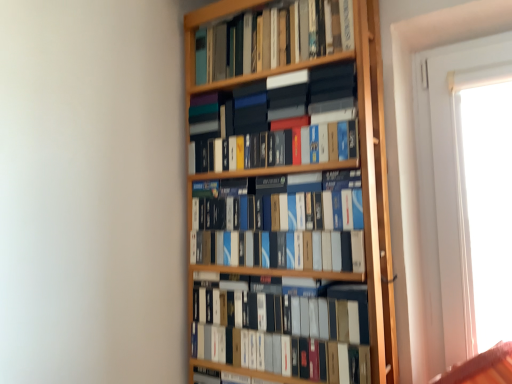
Image resolution: width=512 pixels, height=384 pixels. What are the coordinates of `blue matte book at center, which is the 3th book in top-to-bottom order` in the screenshot? It's located at 276,233.

Find the location of a particular element. Image resolution: width=512 pixels, height=384 pixels. blue matte book at center, the second book from the bottom is located at coordinates (276, 233).

Is hardcover books at upper center, which is the 1th book in top-to-bottom order, oriented towards blue matte book at center, the second book from the bottom?

No.

Which is closer, [289,46] or [279,209]?

The point [279,209] is closer.

Can you see hardcover books at upper center, marked as the 4th book in a bottom-to-top arrangement, touching blue matte book at center, the second book from the bottom?

No, hardcover books at upper center, marked as the 4th book in a bottom-to-top arrangement, is not touching blue matte book at center, the second book from the bottom.

From the image's perspective, which is above, matte black box at center, the 4th book positioned from the top, or hardcover books at upper center, marked as the 4th book in a bottom-to-top arrangement?

From the image's view, hardcover books at upper center, marked as the 4th book in a bottom-to-top arrangement, is above.

Is matte black box at center, positioned as the first book in bottom-to-top order, not within hardcover books at upper center, marked as the 4th book in a bottom-to-top arrangement?

Indeed, matte black box at center, positioned as the first book in bottom-to-top order, is completely outside hardcover books at upper center, marked as the 4th book in a bottom-to-top arrangement.

From a real-world perspective, who is located higher, matte black box at center, positioned as the first book in bottom-to-top order, or hardcover books at upper center, which is the 1th book in top-to-bottom order?

From a 3D spatial view, hardcover books at upper center, which is the 1th book in top-to-bottom order, is above.

From a real-world perspective, count 3rd books upward from the matte black box at center, positioned as the first book in bottom-to-top order, and point to it. Please provide its 2D coordinates.

[(272, 39)]

Is matte black box at center, the 4th book positioned from the top, closer to camera compared to blue matte book at center, the second book from the bottom?

Yes, matte black box at center, the 4th book positioned from the top, is closer to the camera.

Is point (259, 340) farther from camera compared to point (265, 257)?

No.

Consider the image. Is matte black box at center, positioned as the first book in bottom-to-top order, at the right side of blue matte book at center, which is the 3th book in top-to-bottom order?

Yes.

Looking at this image, from a real-world perspective, is matte black box at center, positioned as the first book in bottom-to-top order, on top of blue matte book at center, which is the 3th book in top-to-bottom order?

No, from a real-world perspective, matte black box at center, positioned as the first book in bottom-to-top order, is not above blue matte book at center, which is the 3th book in top-to-bottom order.

Considering the relative sizes of matte black box at center, positioned as the first book in bottom-to-top order, and matte black books at center, the 2th book when ordered from top to bottom, in the image provided, is matte black box at center, positioned as the first book in bottom-to-top order, shorter than matte black books at center, the 2th book when ordered from top to bottom,?

No.

Is the depth of matte black box at center, the 4th book positioned from the top, less than that of matte black books at center, the 2th book when ordered from top to bottom?

That is True.

From the image's perspective, which one is positioned lower, matte black box at center, positioned as the first book in bottom-to-top order, or matte black books at center, the third book positioned from the bottom?

From the image's view, matte black box at center, positioned as the first book in bottom-to-top order, is below.

From the picture: From a real-world perspective, is matte black box at center, the 4th book positioned from the top, positioned above or below matte black books at center, the third book positioned from the bottom?

matte black box at center, the 4th book positioned from the top, is situated lower than matte black books at center, the third book positioned from the bottom, in the real world.

Which is closer, (289, 202) or (308, 100)?

Point (289, 202).

Considering the relative sizes of blue matte book at center, which is the 3th book in top-to-bottom order, and matte black books at center, the 2th book when ordered from top to bottom, in the image provided, is blue matte book at center, which is the 3th book in top-to-bottom order, thinner than matte black books at center, the 2th book when ordered from top to bottom,?

Yes, blue matte book at center, which is the 3th book in top-to-bottom order, is thinner than matte black books at center, the 2th book when ordered from top to bottom.

Is blue matte book at center, which is the 3th book in top-to-bottom order, located outside matte black books at center, the third book positioned from the bottom?

Yes, blue matte book at center, which is the 3th book in top-to-bottom order, is not within matte black books at center, the third book positioned from the bottom.

Which object is further away from the camera taking this photo, blue matte book at center, the second book from the bottom, or matte black books at center, the 2th book when ordered from top to bottom?

matte black books at center, the 2th book when ordered from top to bottom, is behind.

Based on the photo, is matte black books at center, the 2th book when ordered from top to bottom, situated inside hardcover books at upper center, which is the 1th book in top-to-bottom order, or outside?

matte black books at center, the 2th book when ordered from top to bottom, is located beyond the bounds of hardcover books at upper center, which is the 1th book in top-to-bottom order.

From a real-world perspective, which is physically above, matte black books at center, the third book positioned from the bottom, or hardcover books at upper center, marked as the 4th book in a bottom-to-top arrangement?

From a 3D spatial view, hardcover books at upper center, marked as the 4th book in a bottom-to-top arrangement, is above.

Is matte black books at center, the 2th book when ordered from top to bottom, turned away from hardcover books at upper center, marked as the 4th book in a bottom-to-top arrangement?

That's not correct — matte black books at center, the 2th book when ordered from top to bottom, is not looking away from hardcover books at upper center, marked as the 4th book in a bottom-to-top arrangement.

Looking at this image, can you confirm if matte black books at center, the third book positioned from the bottom, is thinner than hardcover books at upper center, which is the 1th book in top-to-bottom order?

No.

Is blue matte book at center, the second book from the bottom, positioned with its back to matte black box at center, positioned as the first book in bottom-to-top order?

blue matte book at center, the second book from the bottom, is not turned away from matte black box at center, positioned as the first book in bottom-to-top order.

Considering the sizes of objects blue matte book at center, the second book from the bottom, and matte black box at center, positioned as the first book in bottom-to-top order, in the image provided, who is thinner, blue matte book at center, the second book from the bottom, or matte black box at center, positioned as the first book in bottom-to-top order,?

matte black box at center, positioned as the first book in bottom-to-top order, is thinner.

Is blue matte book at center, the second book from the bottom, bigger or smaller than matte black box at center, the 4th book positioned from the top?

blue matte book at center, the second book from the bottom, is bigger than matte black box at center, the 4th book positioned from the top.

From the image's perspective, is blue matte book at center, which is the 3th book in top-to-bottom order, positioned above or below matte black box at center, positioned as the first book in bottom-to-top order?

Based on their image positions, blue matte book at center, which is the 3th book in top-to-bottom order, is located above matte black box at center, positioned as the first book in bottom-to-top order.

Locate an element on the screen. the 1st book to the left when counting from the blue matte book at center, which is the 3th book in top-to-bottom order is located at coordinates (272, 39).

Identify the location of the 3rd book in front of the hardcover books at upper center, which is the 1th book in top-to-bottom order, counting from the anchor's position. The image size is (512, 384). tap(276, 336).

Estimate the real-world distances between objects in this image. Which object is further from blue matte book at center, which is the 3th book in top-to-bottom order, matte black box at center, positioned as the first book in bottom-to-top order, or matte black books at center, the third book positioned from the bottom?

matte black books at center, the third book positioned from the bottom, lies further to blue matte book at center, which is the 3th book in top-to-bottom order, than the other object.

Looking at this image, considering their positions, is matte black box at center, the 4th book positioned from the top, positioned further to blue matte book at center, the second book from the bottom, than hardcover books at upper center, marked as the 4th book in a bottom-to-top arrangement?

hardcover books at upper center, marked as the 4th book in a bottom-to-top arrangement, is further to blue matte book at center, the second book from the bottom.

Estimate the real-world distances between objects in this image. Which object is further from hardcover books at upper center, which is the 1th book in top-to-bottom order, blue matte book at center, which is the 3th book in top-to-bottom order, or matte black books at center, the 2th book when ordered from top to bottom?

blue matte book at center, which is the 3th book in top-to-bottom order, is further to hardcover books at upper center, which is the 1th book in top-to-bottom order.

Estimate the real-world distances between objects in this image. Which object is further from matte black box at center, the 4th book positioned from the top, blue matte book at center, which is the 3th book in top-to-bottom order, or matte black books at center, the third book positioned from the bottom?

The object further to matte black box at center, the 4th book positioned from the top, is matte black books at center, the third book positioned from the bottom.

Estimate the real-world distances between objects in this image. Which object is further from hardcover books at upper center, marked as the 4th book in a bottom-to-top arrangement, matte black books at center, the 2th book when ordered from top to bottom, or matte black box at center, positioned as the first book in bottom-to-top order?

matte black box at center, positioned as the first book in bottom-to-top order.

Estimate the real-world distances between objects in this image. Which object is further from blue matte book at center, the second book from the bottom, matte black books at center, the 2th book when ordered from top to bottom, or hardcover books at upper center, marked as the 4th book in a bottom-to-top arrangement?

Among the two, hardcover books at upper center, marked as the 4th book in a bottom-to-top arrangement, is located further to blue matte book at center, the second book from the bottom.

From the image, which object appears to be farther from matte black books at center, the third book positioned from the bottom, blue matte book at center, the second book from the bottom, or matte black box at center, positioned as the first book in bottom-to-top order?

matte black box at center, positioned as the first book in bottom-to-top order, is further to matte black books at center, the third book positioned from the bottom.

Considering their positions, is hardcover books at upper center, marked as the 4th book in a bottom-to-top arrangement, positioned further to matte black box at center, the 4th book positioned from the top, than matte black books at center, the 2th book when ordered from top to bottom?

Based on the image, hardcover books at upper center, marked as the 4th book in a bottom-to-top arrangement, appears to be further to matte black box at center, the 4th book positioned from the top.

Where is `book between hardcover books at upper center, which is the 1th book in top-to-bottom order, and blue matte book at center, which is the 3th book in top-to-bottom order, in the vertical direction`? book between hardcover books at upper center, which is the 1th book in top-to-bottom order, and blue matte book at center, which is the 3th book in top-to-bottom order, in the vertical direction is located at coordinates (306, 89).

Find the location of a particular element. The image size is (512, 384). book between matte black books at center, the 2th book when ordered from top to bottom, and matte black box at center, positioned as the first book in bottom-to-top order, in the vertical direction is located at coordinates pos(276,233).